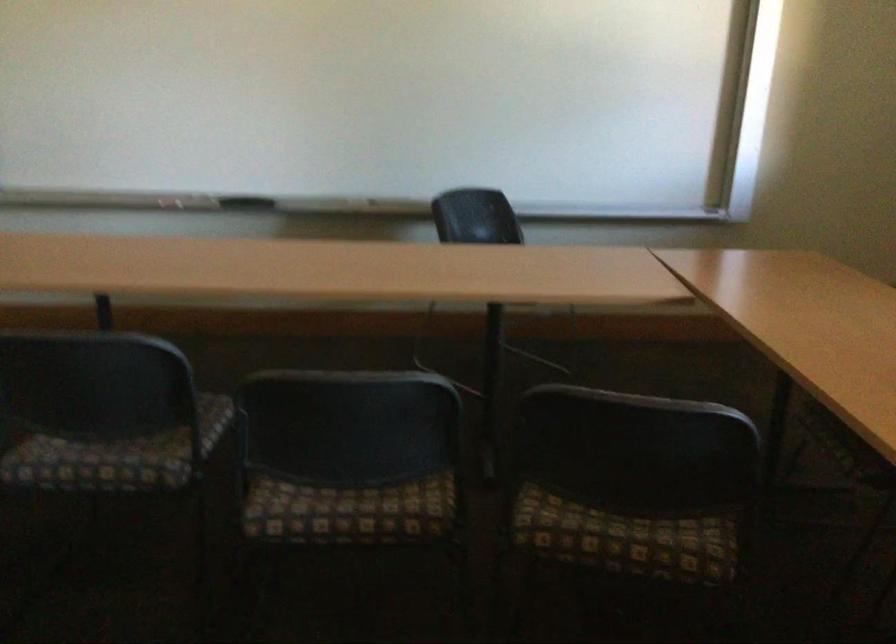
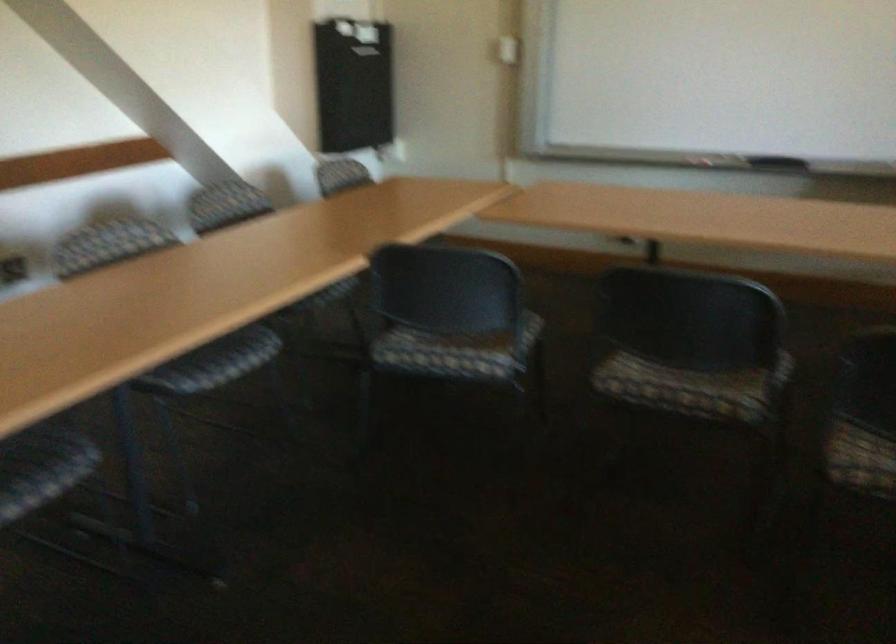
In the second image, find the point that corresponds to [271,513] in the first image.

(858, 456)